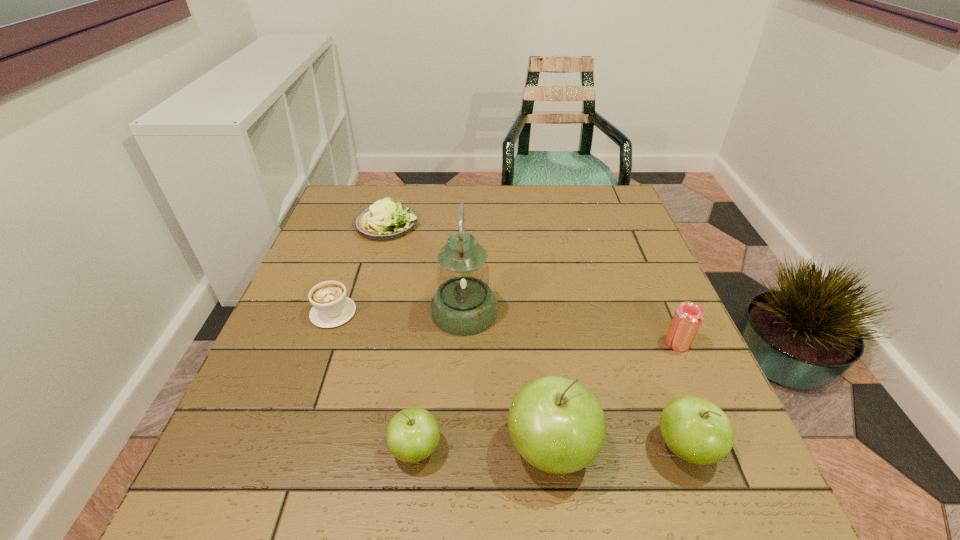
Find the location of a particular element. The height and width of the screenshot is (540, 960). vacant point located between the second apple from right to left and the lettuce is located at coordinates (468, 336).

Point out which object is positioned as the fourth nearest to the rightmost apple. Please provide its 2D coordinates. Your answer should be formatted as a tuple, i.e. [(x, y)], where the tuple contains the x and y coordinates of a point satisfying the conditions above.

[(412, 435)]

Find the location of a particular element. This screenshot has width=960, height=540. object that is the fifth closest one to the lantern is located at coordinates (696, 430).

Locate which apple is the closest to the second apple from right to left. Please provide its 2D coordinates. Your answer should be formatted as a tuple, i.e. [(x, y)], where the tuple contains the x and y coordinates of a point satisfying the conditions above.

[(696, 430)]

At what (x,y) coordinates should I click in order to perform the action: click on apple that is the third nearest to the lantern. Please return your answer as a coordinate pair (x, y). The height and width of the screenshot is (540, 960). Looking at the image, I should click on (696, 430).

Find the location of a particular element. blank space that satisfies the following two spatial constraints: 1. on the back side of the shortest apple; 2. on the left side of the tallest apple is located at coordinates coord(416,448).

The image size is (960, 540). In order to click on vacant area in the image that satisfies the following two spatial constraints: 1. to the right of the cappuccino's handle; 2. on the right side of the lettuce in this screenshot , I will do `click(364, 225)`.